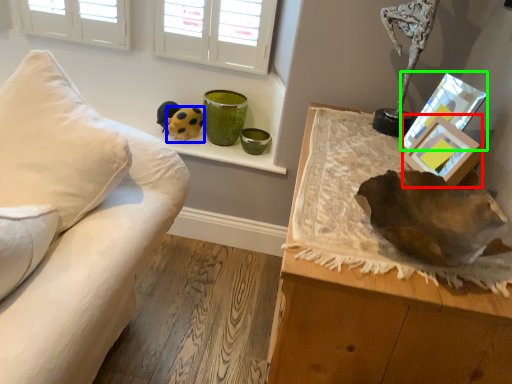
Question: Which object is positioned closest to picture frame (highlighted by a red box)? Select from toy (highlighted by a blue box) and picture frame (highlighted by a green box).

Choices:
 (A) toy
 (B) picture frame

Answer: (B)